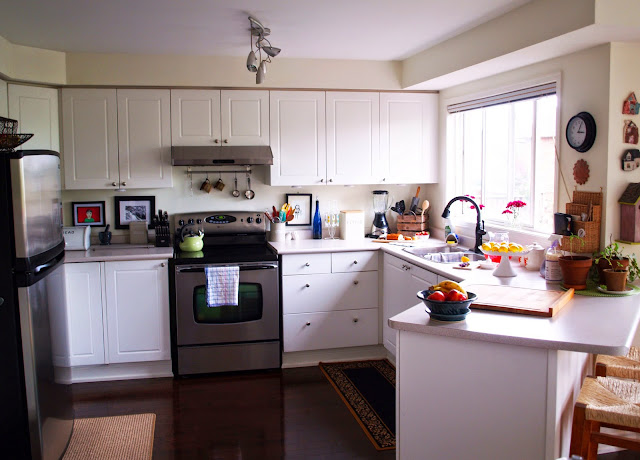
Where is `refridgerator`? refridgerator is located at coordinates (35, 302).